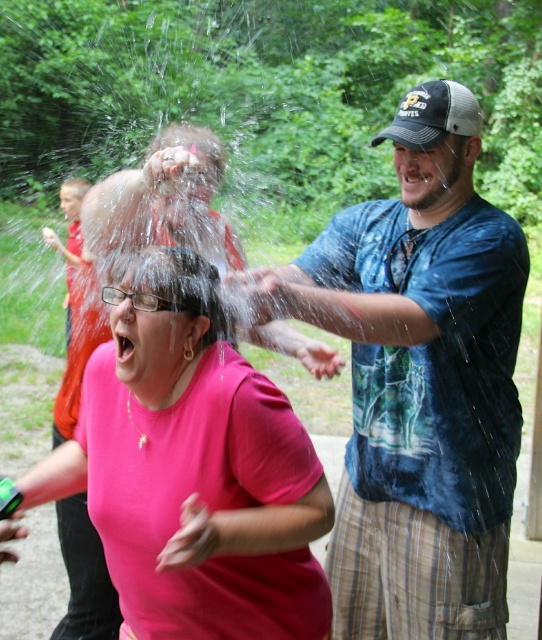
You are observing an outdoor scene where a woman in a pink matte shirt at center and a man in a red shirt at left are interacting. Which person is positioned closer to you?

The pink matte shirt at center is closer to the viewer than the red shirt at left, so the woman in the pink matte shirt at center is positioned closer to you.

You are organizing a fashion show and need to decide which outfit takes more space on the runway. Based on the scene, which outfit between the pink matte shirt at center and the red shirt at left would require a wider runway section?

The pink matte shirt at center requires a wider runway section because its width is larger than the red shirt at left.